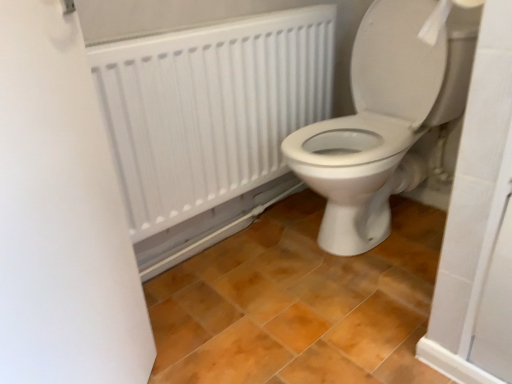
Question: Would you say white glossy toilet at center is inside or outside brown matte tile at center?

Choices:
 (A) outside
 (B) inside

Answer: (A)

Question: Does point (355, 163) appear closer or farther from the camera than point (394, 309)?

Choices:
 (A) farther
 (B) closer

Answer: (B)

Question: Which is farther from the white matte screen door at left?

Choices:
 (A) white paper at upper right
 (B) white glossy toilet at center
 (C) brown matte tile at center
 (D) white matte radiator at upper center

Answer: (A)

Question: Estimate the real-world distances between objects in this image. Which object is closer to the white matte screen door at left?

Choices:
 (A) white matte radiator at upper center
 (B) white paper at upper right
 (C) brown matte tile at center
 (D) white glossy toilet at center

Answer: (A)